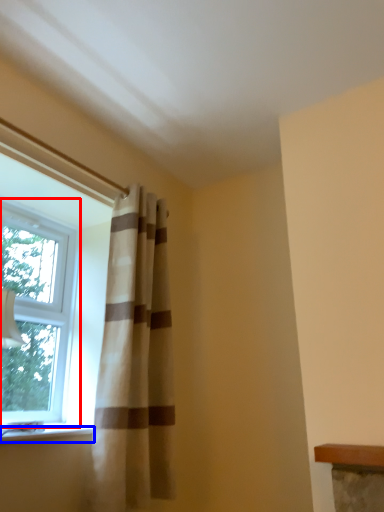
Question: Which object is further to the camera taking this photo, window (highlighted by a red box) or window sill (highlighted by a blue box)?

Choices:
 (A) window
 (B) window sill

Answer: (A)